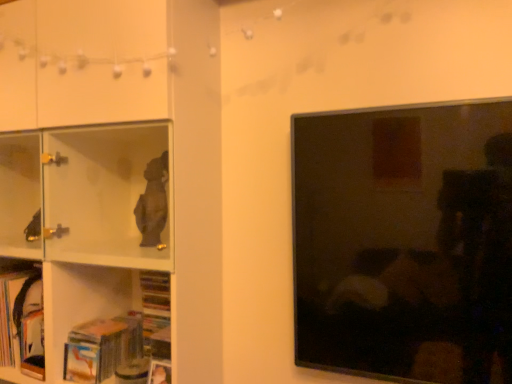
Question: From the image's perspective, is matte black tv at right positioned above or below hardcover book at lower left, acting as the second book starting from the left?

Choices:
 (A) above
 (B) below

Answer: (A)

Question: From a real-world perspective, is matte black tv at right positioned above or below hardcover book at lower left, positioned as the 1th book in right-to-left order?

Choices:
 (A) below
 (B) above

Answer: (B)

Question: Based on their relative distances, which object is farther from the hardcover book at lower left, which is the 1th book from left to right?

Choices:
 (A) matte black tv at right
 (B) white glossy shelf at left
 (C) hardcover book at lower left, positioned as the 1th book in right-to-left order

Answer: (A)

Question: Which object is positioned farthest from the white glossy shelf at left?

Choices:
 (A) matte black tv at right
 (B) hardcover book at lower left, positioned as the 1th book in right-to-left order
 (C) hardcover book at lower left, which is the 2th book from right to left

Answer: (C)